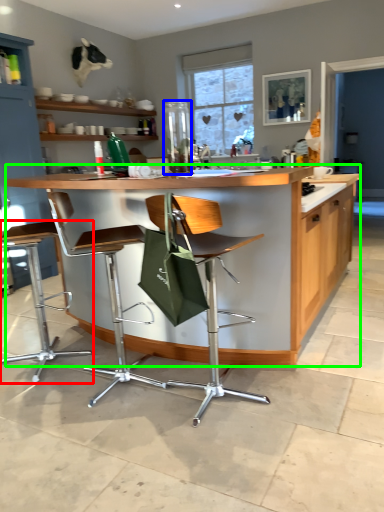
Question: Which object is the farthest from chair (highlighted by a red box)? Choose among these: appliance (highlighted by a blue box) or countertop (highlighted by a green box).

Choices:
 (A) appliance
 (B) countertop

Answer: (A)